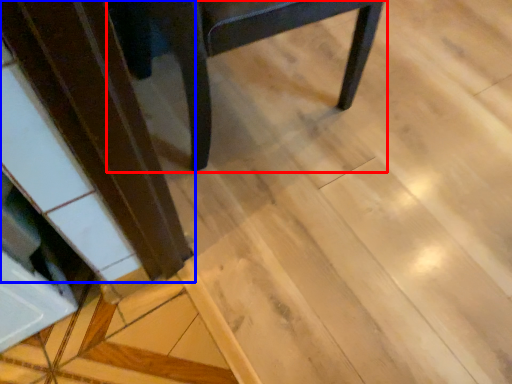
Question: Among these objects, which one is farthest to the camera, chair (highlighted by a red box) or wood (highlighted by a blue box)?

Choices:
 (A) chair
 (B) wood

Answer: (B)